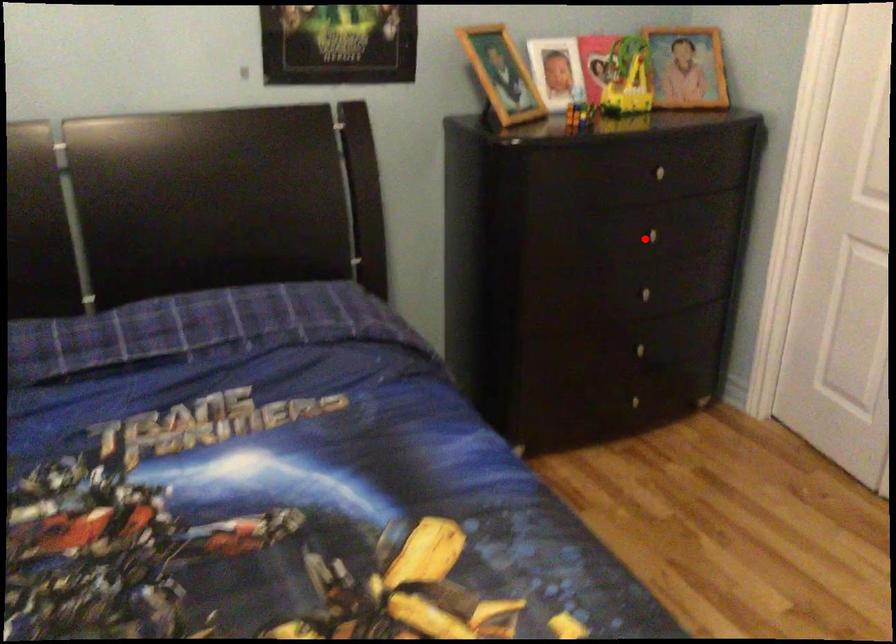
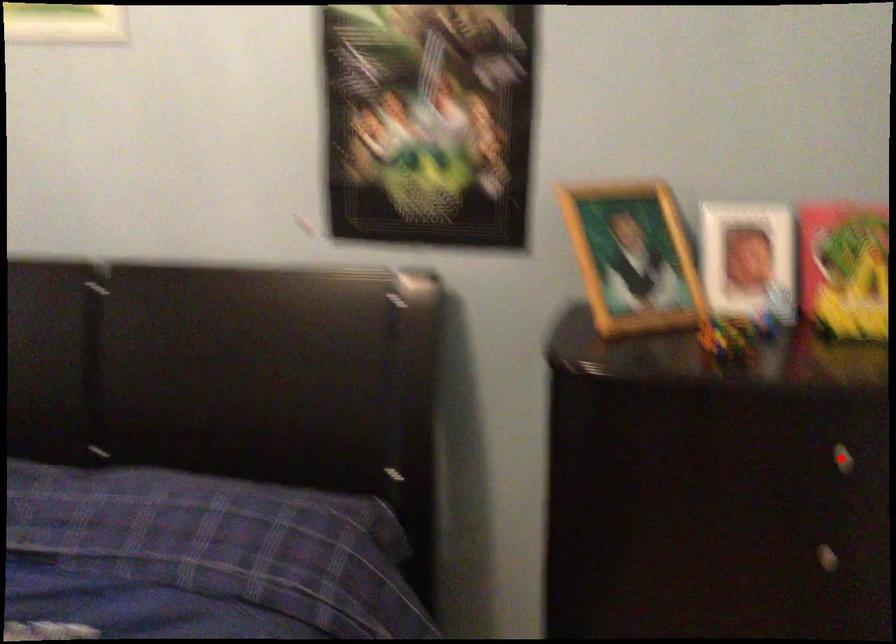
I am providing you with two images of the same scene from different viewpoints. A red point is marked on the first image and another point is marked on the second image. Are the points marked in image1 and image2 representing the same 3D position?

No